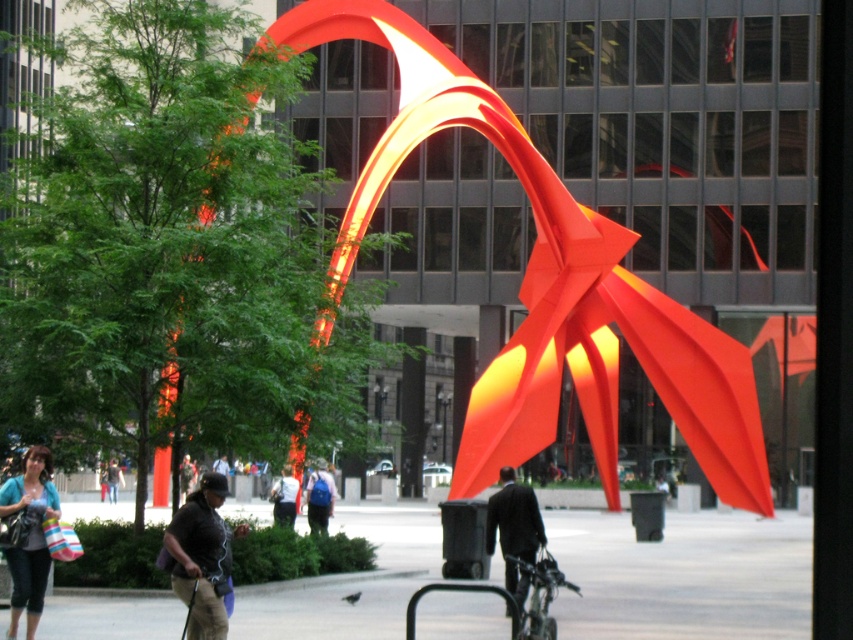
Is matte blue shirt at lower left to the left of light blue denim jacket at center from the viewer's perspective?

Indeed, matte blue shirt at lower left is positioned on the left side of light blue denim jacket at center.

Measure the distance between matte blue shirt at lower left and camera.

The distance of matte blue shirt at lower left from camera is 15.11 meters.

This screenshot has height=640, width=853. What are the coordinates of `matte blue shirt at lower left` in the screenshot? It's located at (28, 536).

Find the location of a particular element. This screenshot has width=853, height=640. dark suit at center is located at coordinates point(514,529).

Who is taller, dark suit at center or light blue denim jacket at center?

With more height is light blue denim jacket at center.

Is point (525, 532) farther from viewer compared to point (291, 509)?

No, (525, 532) is in front of (291, 509).

Locate an element on the screen. This screenshot has height=640, width=853. dark suit at center is located at coordinates (514, 529).

The height and width of the screenshot is (640, 853). In order to click on matte blue shirt at lower left in this screenshot , I will do [x=28, y=536].

Which is more to the right, matte blue shirt at lower left or dark suit at center?

From the viewer's perspective, dark suit at center appears more on the right side.

Is point (38, 582) in front of point (523, 506)?

That is True.

At what (x,y) coordinates should I click in order to perform the action: click on matte blue shirt at lower left. Please return your answer as a coordinate pair (x, y). The width and height of the screenshot is (853, 640). Looking at the image, I should click on (28, 536).